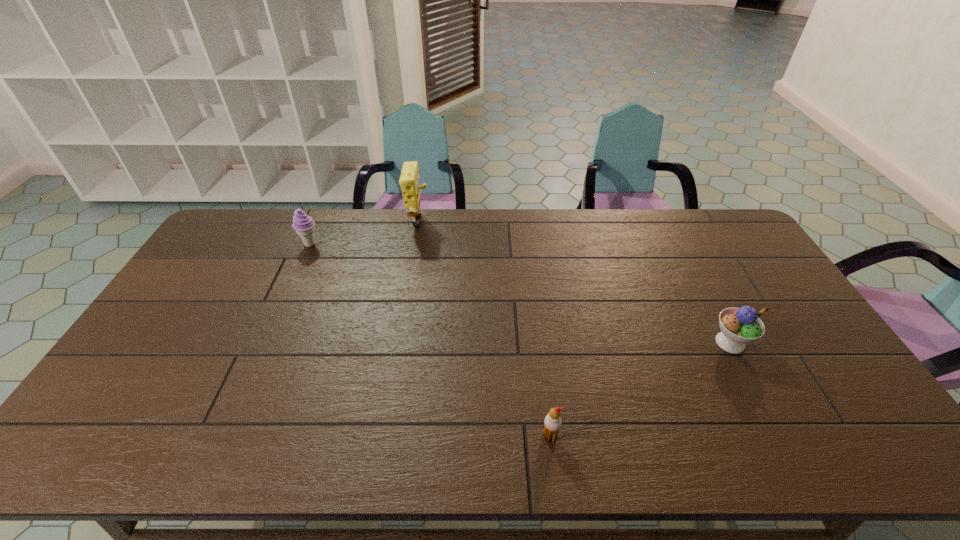
This screenshot has width=960, height=540. In order to click on the third object from right to left in this screenshot , I will do `click(409, 181)`.

You are a GUI agent. You are given a task and a screenshot of the screen. Output one action in this format:
    pyautogui.click(x=<x>, y=<y>)
    Task: Click on the tallest object
    Image resolution: width=960 pixels, height=540 pixels.
    Given the screenshot: What is the action you would take?
    [x=409, y=181]

Where is `the leftmost object`? The image size is (960, 540). the leftmost object is located at coordinates (303, 224).

Image resolution: width=960 pixels, height=540 pixels. In order to click on the leftmost icecream in this screenshot , I will do `click(303, 224)`.

Where is `the second nearest icecream`? Image resolution: width=960 pixels, height=540 pixels. the second nearest icecream is located at coordinates (738, 326).

You are a GUI agent. You are given a task and a screenshot of the screen. Output one action in this format:
    pyautogui.click(x=<x>, y=<y>)
    Task: Click on the rightmost icecream
    The width and height of the screenshot is (960, 540).
    Given the screenshot: What is the action you would take?
    pyautogui.click(x=738, y=326)

You are a GUI agent. You are given a task and a screenshot of the screen. Output one action in this format:
    pyautogui.click(x=<x>, y=<y>)
    Task: Click on the shortest icecream
    The width and height of the screenshot is (960, 540).
    Given the screenshot: What is the action you would take?
    pyautogui.click(x=552, y=423)

You are a GUI agent. You are given a task and a screenshot of the screen. Output one action in this format:
    pyautogui.click(x=<x>, y=<y>)
    Task: Click on the second icecream from right to left
    
    Given the screenshot: What is the action you would take?
    pyautogui.click(x=552, y=423)

What are the coordinates of `vacant space located 0.150m on the face of the second object from left to right` in the screenshot? It's located at (469, 225).

Locate an element on the screen. The width and height of the screenshot is (960, 540). vacant region located 0.110m on the front of the leftmost icecream is located at coordinates (298, 272).